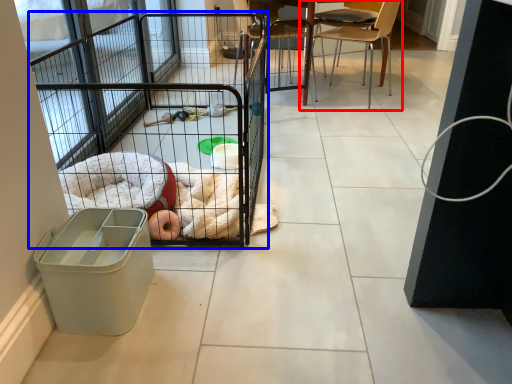
Question: Which object appears farthest to the camera in this image, chair (highlighted by a red box) or cage (highlighted by a blue box)?

Choices:
 (A) chair
 (B) cage

Answer: (A)